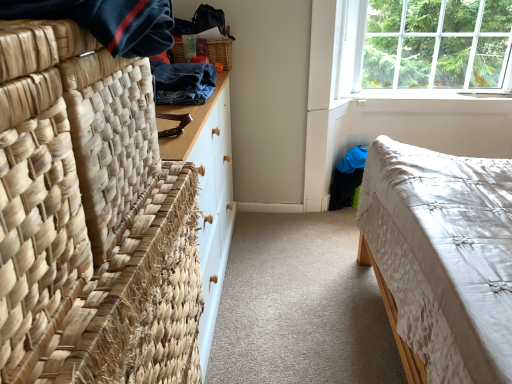
Question: Would you say denim fabric at upper left, the second clothing from the front, is inside or outside natural woven mat at left?

Choices:
 (A) outside
 (B) inside

Answer: (A)

Question: From the image's perspective, is denim fabric at upper left, the second clothing from the front, positioned above or below natural woven mat at left?

Choices:
 (A) above
 (B) below

Answer: (A)

Question: Based on their relative distances, which object is nearer to the denim fabric at upper left, acting as the first clothing starting from the back?

Choices:
 (A) natural woven mat at left
 (B) clear glass window at upper right
 (C) dark blue woven fabric at upper left, which is the 1th clothing from front to back
 (D) white quilted fabric bed at lower right
 (E) woven wood picnic basket at upper center

Answer: (E)

Question: Which object is the farthest from the clear glass window at upper right?

Choices:
 (A) natural woven mat at left
 (B) denim fabric at upper left, the second clothing from the front
 (C) dark blue woven fabric at upper left, which is the 1th clothing from front to back
 (D) woven wood picnic basket at upper center
 (E) white quilted fabric bed at lower right

Answer: (C)